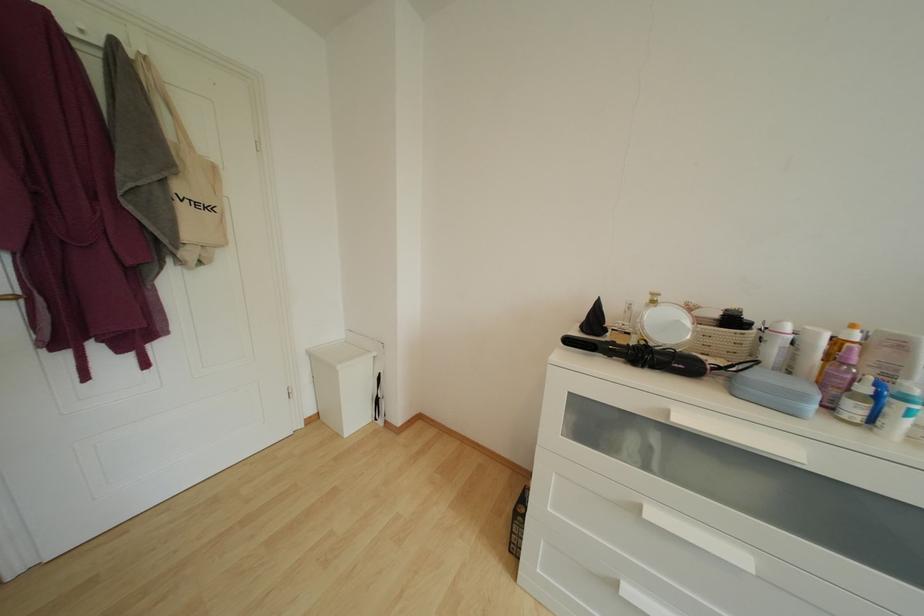
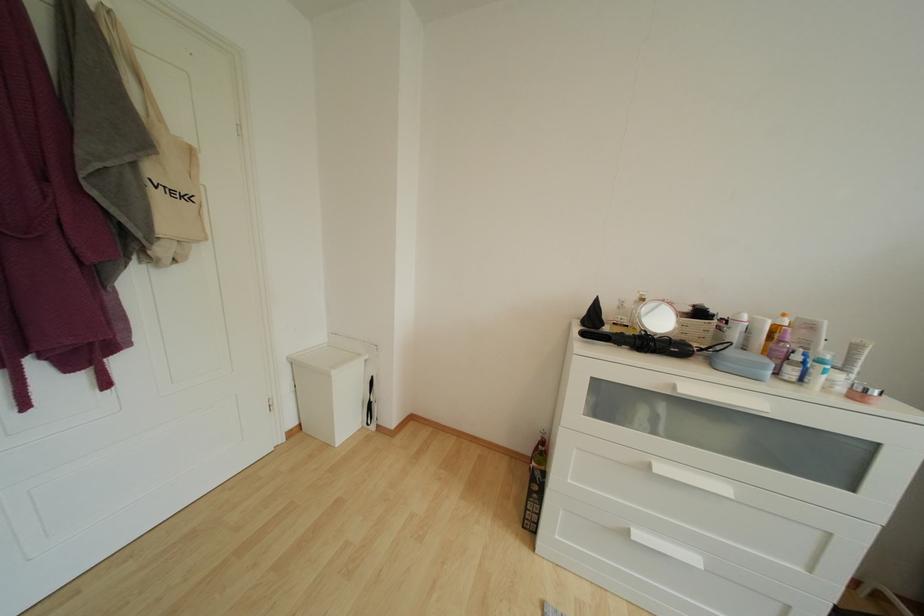
Where in the second image is the point corresponding to pixel 665 302 from the first image?

(651, 301)